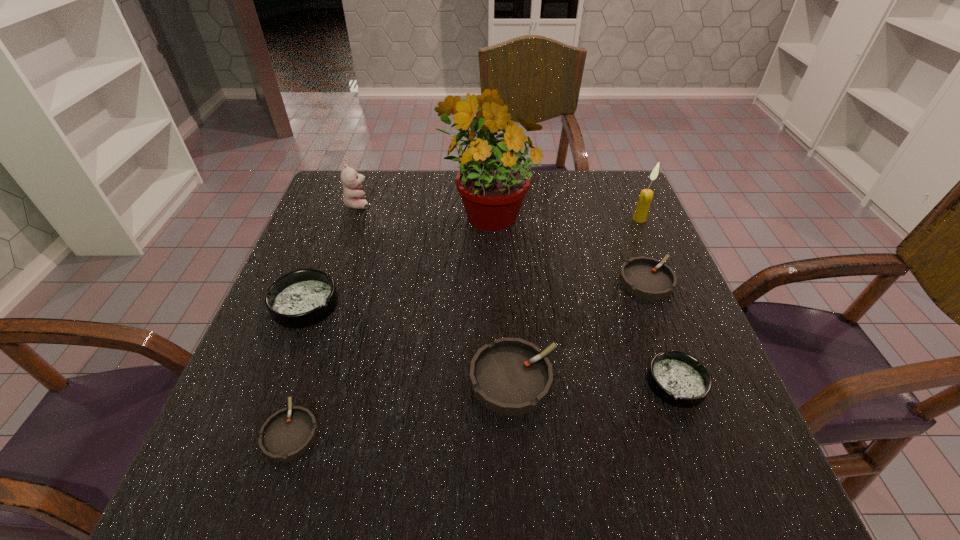
The image size is (960, 540). I want to click on flowerpot, so click(x=492, y=183).

Where is `the tallest object`? The height and width of the screenshot is (540, 960). the tallest object is located at coordinates (492, 183).

Where is `the second tallest object`? The height and width of the screenshot is (540, 960). the second tallest object is located at coordinates coord(646,195).

I want to click on candle, so click(646, 195).

The width and height of the screenshot is (960, 540). Identify the location of pink teddy bear. coord(353,197).

I want to click on teddy bear, so click(x=353, y=197).

At what (x,y) coordinates should I click in order to perform the action: click on the biggest gray ashtray. Please return your answer as a coordinate pair (x, y). Looking at the image, I should click on (510, 376).

Locate an element on the screen. The image size is (960, 540). the third ashtray from left to right is located at coordinates (510, 376).

Locate an element on the screen. The height and width of the screenshot is (540, 960). the farther dark ashtray is located at coordinates (301, 298).

I want to click on the bigger dark ashtray, so pos(301,298).